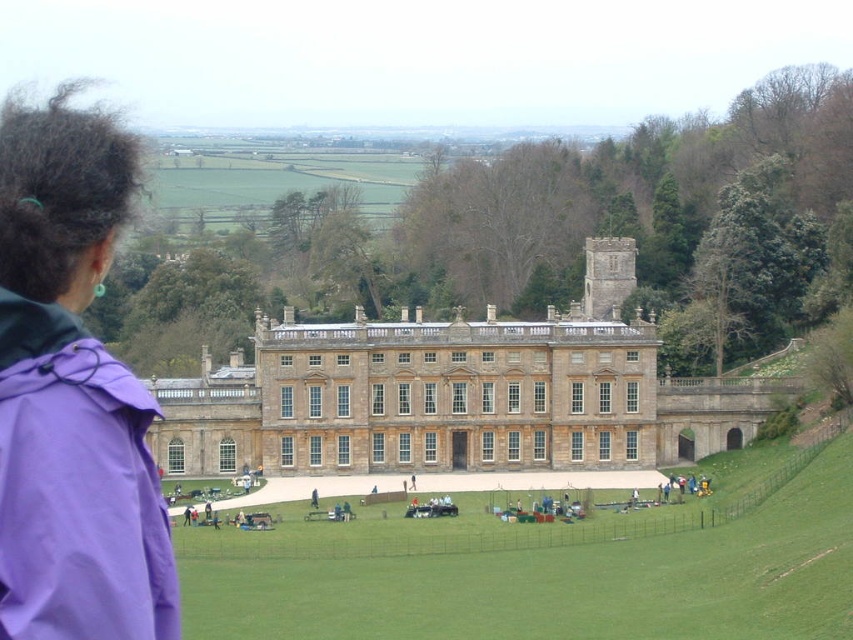
Question: Is light brown stone palace at center below purple fabric at left?

Choices:
 (A) no
 (B) yes

Answer: (B)

Question: Which of the following is the closest to the observer?

Choices:
 (A) light brown stone palace at center
 (B) purple fabric at left

Answer: (B)

Question: Is light brown stone palace at center smaller than purple fabric at left?

Choices:
 (A) yes
 (B) no

Answer: (A)

Question: Where is light brown stone palace at center located in relation to purple fabric at left in the image?

Choices:
 (A) above
 (B) below

Answer: (B)